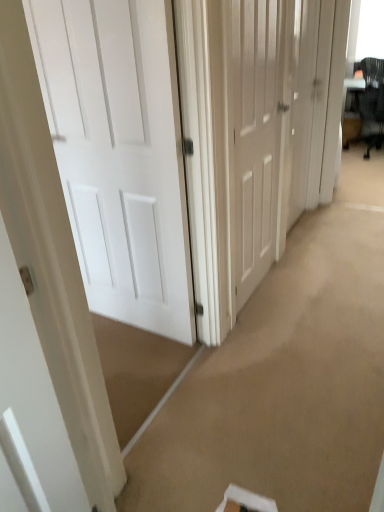
Question: Is white matte door at center, positioned as the third door in right-to-left order, facing away from white matte door at center, which ranks as the 3th door in left-to-right order?

Choices:
 (A) yes
 (B) no

Answer: (B)

Question: Does white matte door at center, positioned as the third door in right-to-left order, turn towards white matte door at center, the first door positioned from the right?

Choices:
 (A) yes
 (B) no

Answer: (B)

Question: Does white matte door at center, the first door when ordered from left to right, have a lesser width compared to white matte door at center, which ranks as the 3th door in left-to-right order?

Choices:
 (A) no
 (B) yes

Answer: (A)

Question: Does white matte door at center, positioned as the third door in right-to-left order, have a lesser height compared to white matte door at center, the first door positioned from the right?

Choices:
 (A) no
 (B) yes

Answer: (B)

Question: Considering the relative sizes of white matte door at center, positioned as the third door in right-to-left order, and white matte door at center, which ranks as the 3th door in left-to-right order, in the image provided, is white matte door at center, positioned as the third door in right-to-left order, smaller than white matte door at center, which ranks as the 3th door in left-to-right order,?

Choices:
 (A) yes
 (B) no

Answer: (B)

Question: Does white matte door at center, the first door when ordered from left to right, contain white matte door at center, which ranks as the 3th door in left-to-right order?

Choices:
 (A) no
 (B) yes

Answer: (A)

Question: Is white matte door at center, the first door positioned from the right, in front of black mesh swivel chair at upper right?

Choices:
 (A) yes
 (B) no

Answer: (A)

Question: From a real-world perspective, is white matte door at center, the first door positioned from the right, on black mesh swivel chair at upper right?

Choices:
 (A) no
 (B) yes

Answer: (B)

Question: Is black mesh swivel chair at upper right at the back of white matte door at center, the first door positioned from the right?

Choices:
 (A) no
 (B) yes

Answer: (A)

Question: Is black mesh swivel chair at upper right located within white matte door at center, which ranks as the 3th door in left-to-right order?

Choices:
 (A) yes
 (B) no

Answer: (B)

Question: Is white matte door at center, the first door positioned from the right, at the left side of black mesh swivel chair at upper right?

Choices:
 (A) no
 (B) yes

Answer: (B)

Question: From the image's perspective, is white matte door at center, the first door positioned from the right, on top of black mesh swivel chair at upper right?

Choices:
 (A) no
 (B) yes

Answer: (A)

Question: Is white matte door at center, the first door when ordered from left to right, surrounding white matte door at center, which ranks as the 2th door in right-to-left order?

Choices:
 (A) no
 (B) yes

Answer: (A)